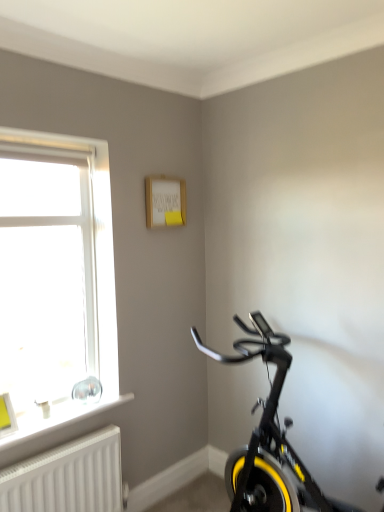
Question: Is white plastic window sill at lower left thinner than yellow rubber bicycle wheel at lower right?

Choices:
 (A) yes
 (B) no

Answer: (B)

Question: From a real-world perspective, is white plastic window sill at lower left over yellow rubber bicycle wheel at lower right?

Choices:
 (A) yes
 (B) no

Answer: (A)

Question: Is white plastic window sill at lower left smaller than yellow rubber bicycle wheel at lower right?

Choices:
 (A) no
 (B) yes

Answer: (A)

Question: Can yellow rubber bicycle wheel at lower right be found inside white plastic window sill at lower left?

Choices:
 (A) yes
 (B) no

Answer: (B)

Question: From the image's perspective, is white plastic window sill at lower left located beneath yellow rubber bicycle wheel at lower right?

Choices:
 (A) yes
 (B) no

Answer: (B)

Question: Would you say yellow rubber bicycle wheel at lower right is inside or outside black matte exercise bike at lower right?

Choices:
 (A) outside
 (B) inside

Answer: (A)

Question: Is point (261, 451) closer or farther from the camera than point (281, 443)?

Choices:
 (A) farther
 (B) closer

Answer: (A)

Question: From the image's perspective, is yellow rubber bicycle wheel at lower right positioned above or below black matte exercise bike at lower right?

Choices:
 (A) below
 (B) above

Answer: (A)

Question: From a real-world perspective, is yellow rubber bicycle wheel at lower right positioned above or below black matte exercise bike at lower right?

Choices:
 (A) above
 (B) below

Answer: (B)

Question: From the image's perspective, relative to white plastic window sill at lower left, is black matte exercise bike at lower right above or below?

Choices:
 (A) above
 (B) below

Answer: (B)

Question: Is point (294, 455) positioned closer to the camera than point (84, 404)?

Choices:
 (A) farther
 (B) closer

Answer: (A)

Question: In terms of width, does black matte exercise bike at lower right look wider or thinner when compared to white plastic window sill at lower left?

Choices:
 (A) thin
 (B) wide

Answer: (B)

Question: From their relative heights in the image, would you say black matte exercise bike at lower right is taller or shorter than white plastic window sill at lower left?

Choices:
 (A) tall
 (B) short

Answer: (A)

Question: Would you say white plastic window at left is to the left or to the right of white plastic window sill at lower left in the picture?

Choices:
 (A) left
 (B) right

Answer: (A)

Question: From a real-world perspective, is white plastic window at left physically located above or below white plastic window sill at lower left?

Choices:
 (A) below
 (B) above

Answer: (B)